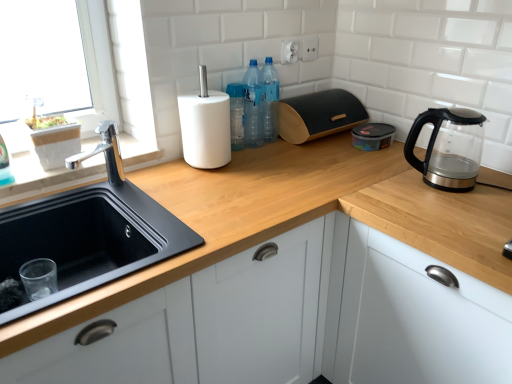
Locate an element on the screen. vacant area that lies to the right of translucent plastic bottles at center, arranged as the second bottle when viewed from the right is located at coordinates (295, 145).